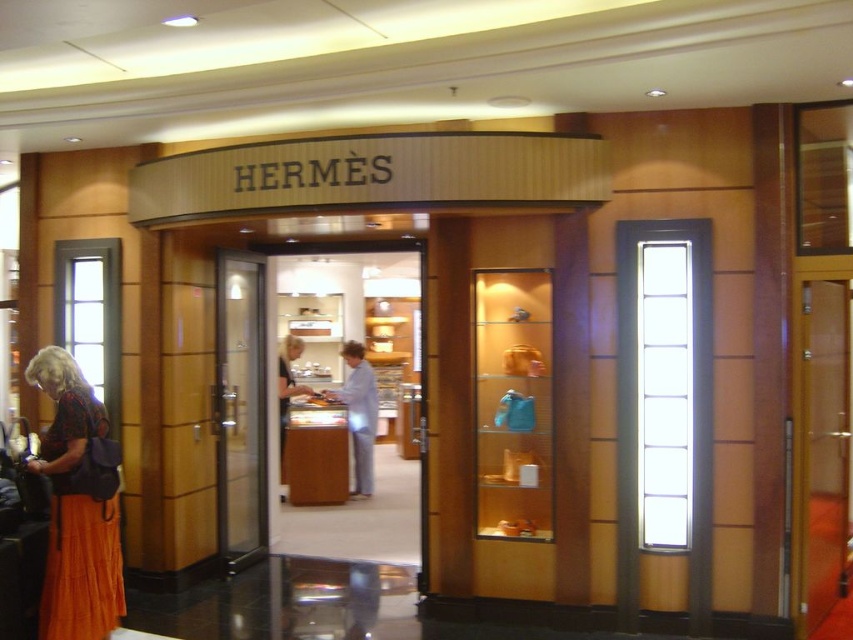
Can you confirm if wooden counter at center is positioned below orange skirt at lower left?

Yes, wooden counter at center is below orange skirt at lower left.

This screenshot has width=853, height=640. I want to click on wooden counter at center, so click(376, 396).

Measure the distance between point (251, 545) and camera.

Point (251, 545) is 19.30 feet away from camera.

What do you see at coordinates (241, 408) in the screenshot? I see `transparent glass door at center` at bounding box center [241, 408].

Locate an element on the screen. The height and width of the screenshot is (640, 853). transparent glass door at center is located at coordinates (241, 408).

Image resolution: width=853 pixels, height=640 pixels. Find the location of `transparent glass door at center`. transparent glass door at center is located at coordinates (241, 408).

Does orange skirt at lower left lie in front of light beige fabric jacket at center?

Yes, it is in front of light beige fabric jacket at center.

Between orange skirt at lower left and light beige fabric jacket at center, which one appears on the right side from the viewer's perspective?

From the viewer's perspective, light beige fabric jacket at center appears more on the right side.

Which is in front, point (80, 413) or point (283, 400)?

Point (80, 413)

Locate an element on the screen. Image resolution: width=853 pixels, height=640 pixels. orange skirt at lower left is located at coordinates (77, 506).